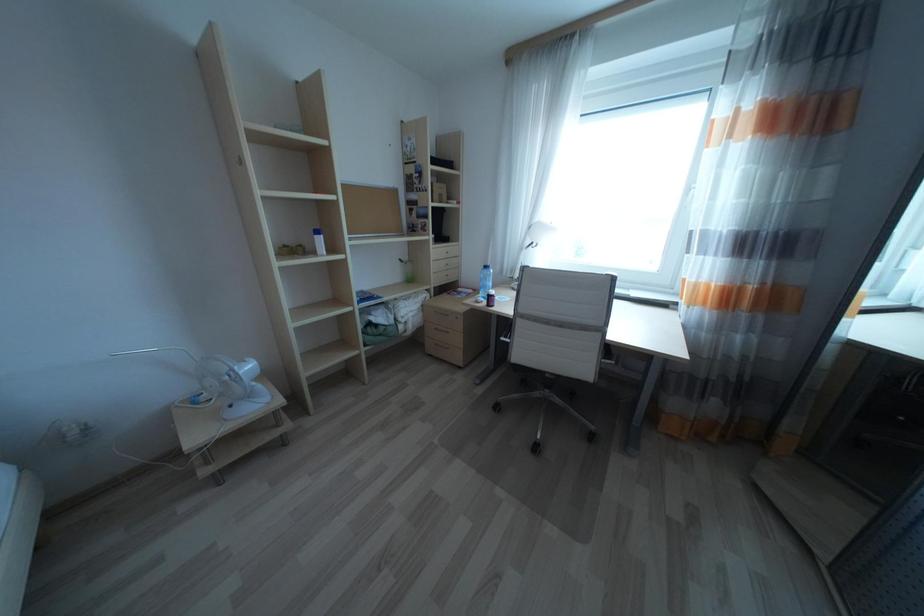
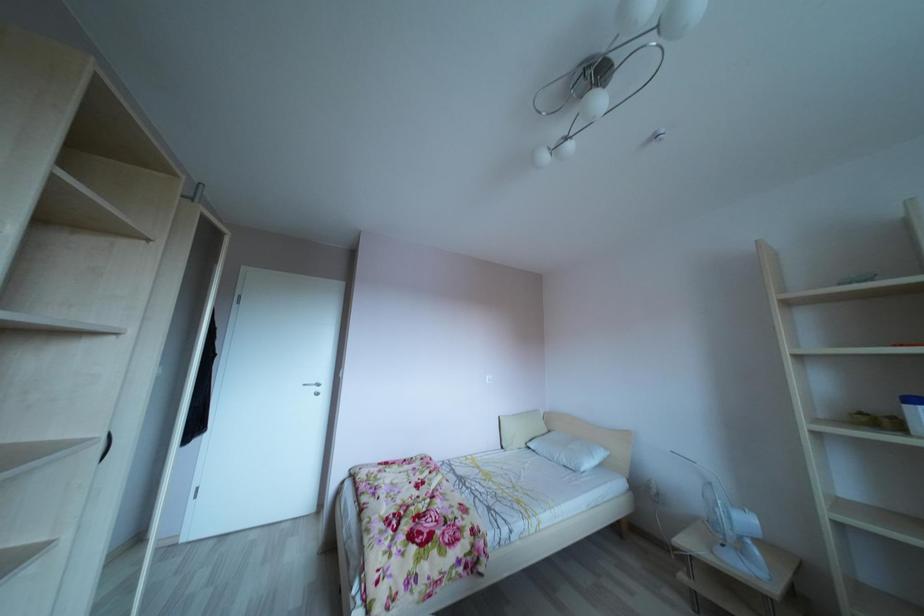
Question: The images are taken continuously from a first-person perspective. In which direction is your viewpoint rotating?

Choices:
 (A) Left
 (B) Right
 (C) Up
 (D) Down

Answer: (A)